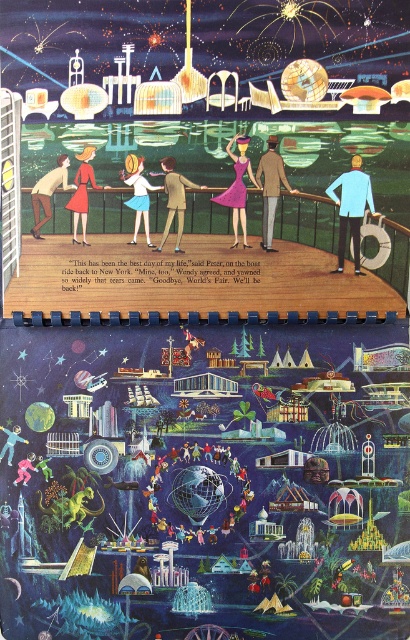
Question: Is light blue fabric jacket at upper right thinner than matte brown suit at center?

Choices:
 (A) yes
 (B) no

Answer: (B)

Question: Estimate the real-world distances between objects in this image. Which object is farther from the matte brown suit at center?

Choices:
 (A) matte white dress at center
 (B) tan fabric jacket at center
 (C) matte red dress at left

Answer: (C)

Question: Is tan fabric jacket at center to the left of matte brown suit at center from the viewer's perspective?

Choices:
 (A) no
 (B) yes

Answer: (A)

Question: Estimate the real-world distances between objects in this image. Which object is closer to the matte purple dress at center?

Choices:
 (A) matte white dress at center
 (B) matte brown suit at center
 (C) tan fabric jacket at center
 (D) matte red dress at upper left

Answer: (C)

Question: Which object appears farthest from the camera in this image?

Choices:
 (A) matte brown suit at center
 (B) light blue fabric jacket at upper right
 (C) matte purple dress at center

Answer: (A)

Question: From the image, what is the correct spatial relationship of matte purple dress at center in relation to matte white dress at center?

Choices:
 (A) below
 (B) above

Answer: (B)